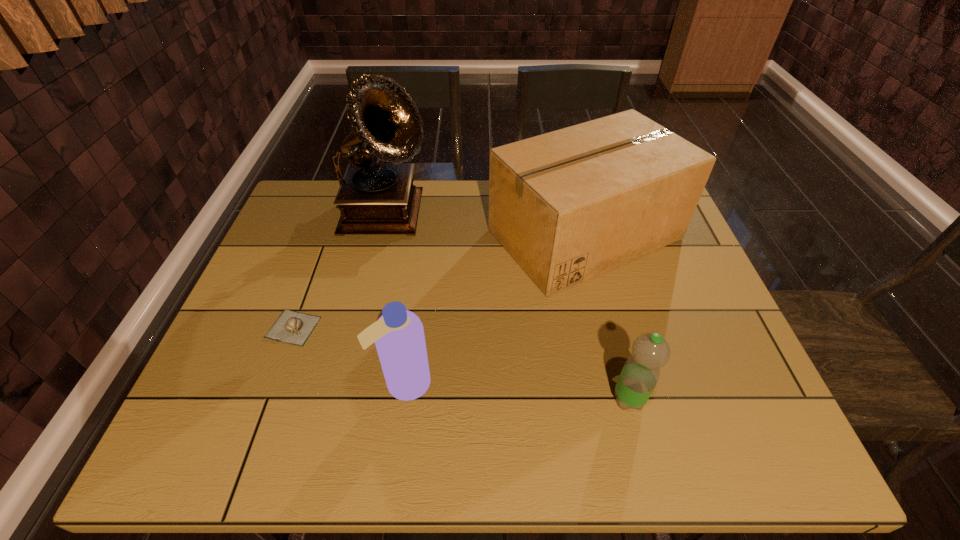
The image size is (960, 540). Find the location of `free space located on the right of the third nearest object`. free space located on the right of the third nearest object is located at coordinates (348, 327).

Find the location of `record player located at the far edge`. record player located at the far edge is located at coordinates (374, 198).

I want to click on box located in the far edge section of the desktop, so (x=568, y=205).

Identify the location of object at the left edge. (292, 327).

Where is `object present at the right edge`? This screenshot has height=540, width=960. object present at the right edge is located at coordinates (568, 205).

The width and height of the screenshot is (960, 540). Identify the location of object that is positioned at the far right corner. (568, 205).

Identify the location of vacant area at the far edge. The width and height of the screenshot is (960, 540). (440, 200).

In order to click on free location at the near edge of the desktop in this screenshot , I will do `click(662, 457)`.

Image resolution: width=960 pixels, height=540 pixels. I want to click on vacant space at the left edge, so click(x=208, y=401).

Where is `free space at the right edge of the desktop`? This screenshot has height=540, width=960. free space at the right edge of the desktop is located at coordinates (639, 271).